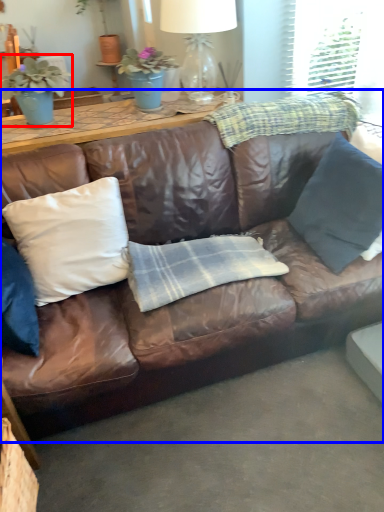
Question: Which object is further to the camera taking this photo, houseplant (highlighted by a red box) or studio couch (highlighted by a blue box)?

Choices:
 (A) houseplant
 (B) studio couch

Answer: (A)